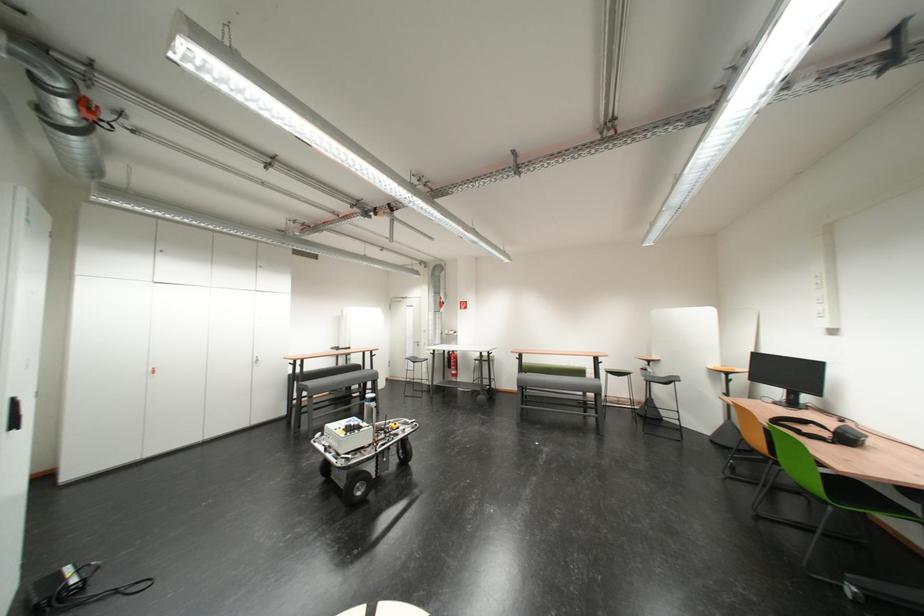
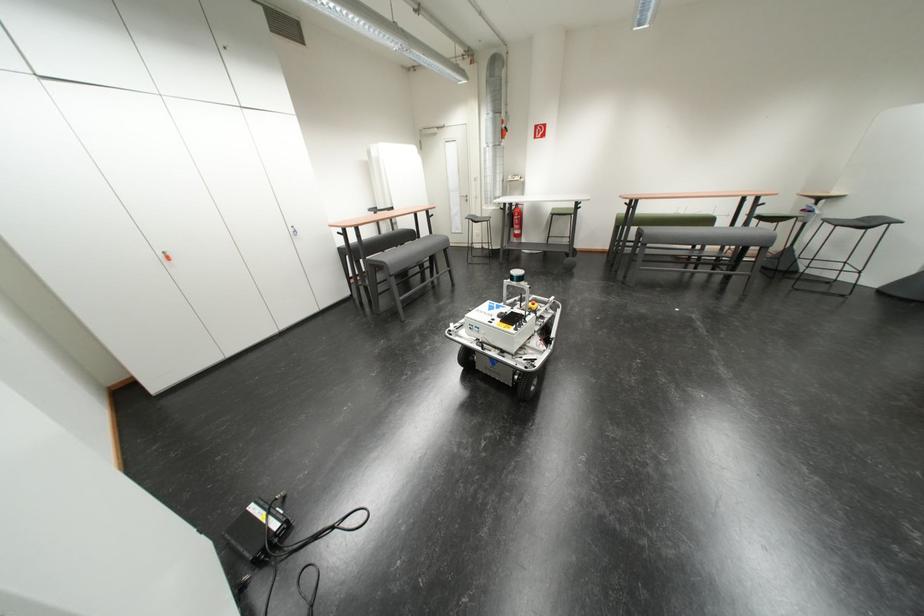
In the second image, find the point that corresponds to point (532, 370) in the first image.

(638, 223)